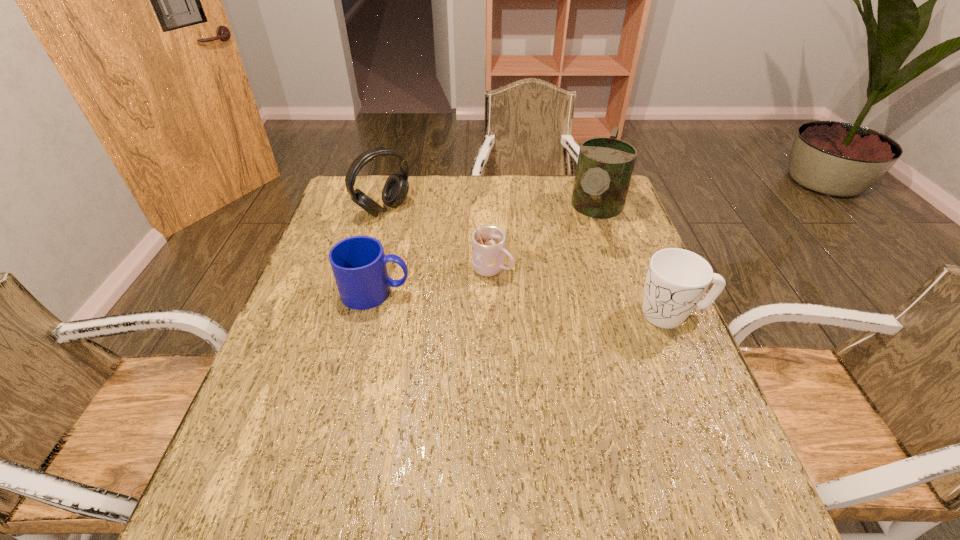
This screenshot has width=960, height=540. I want to click on the left mug, so click(358, 263).

The image size is (960, 540). Identify the location of the right mug. (677, 279).

I want to click on the fourth shortest object, so click(395, 190).

Locate an element on the screen. The height and width of the screenshot is (540, 960). the third object from left to right is located at coordinates (488, 242).

Identify the location of watering can. (605, 165).

In order to click on free region located on the side with the handle of the shorter mug in this screenshot , I will do `click(561, 292)`.

Where is `free point located on the side of the right mug with the handle`? Image resolution: width=960 pixels, height=540 pixels. free point located on the side of the right mug with the handle is located at coordinates (478, 314).

The height and width of the screenshot is (540, 960). Find the location of `free space located on the side of the right mug with the handle`. free space located on the side of the right mug with the handle is located at coordinates (602, 314).

Identify the location of free space located 0.070m on the side of the right mug with the handle. (607, 314).

Locate an element on the screen. This screenshot has width=960, height=540. free region located 0.340m on the earcups of the headset is located at coordinates (472, 278).